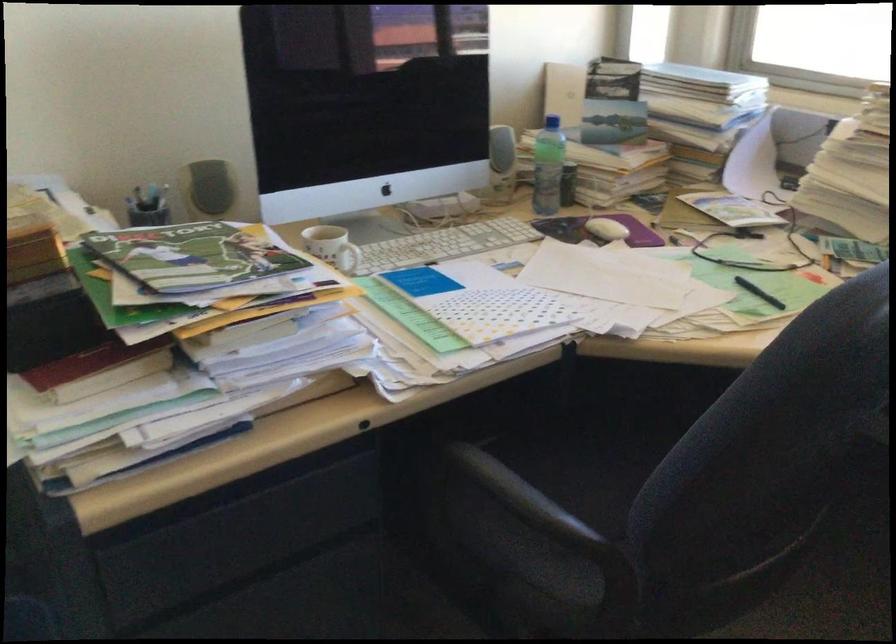
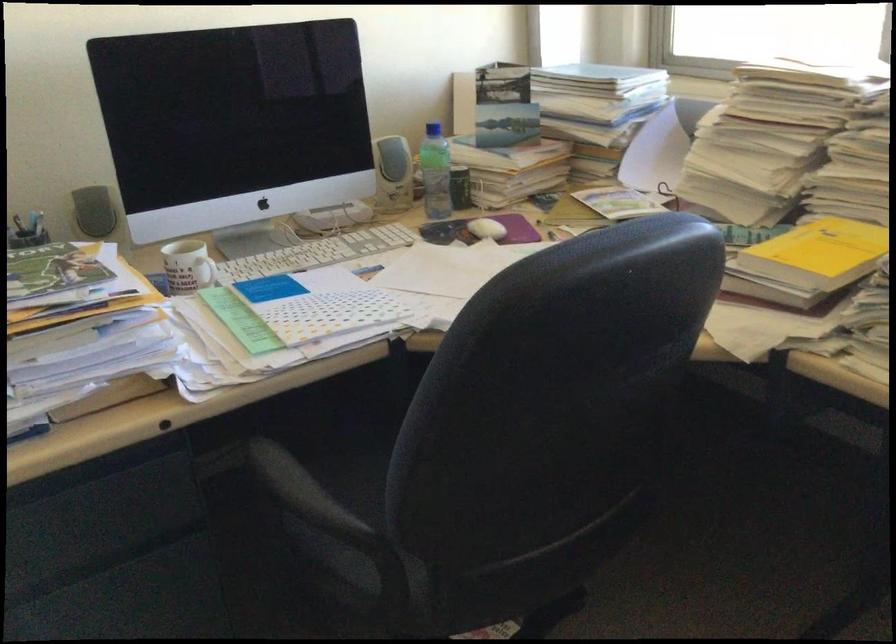
Find the pixel in the second image that matches (348,261) in the first image.

(204, 272)